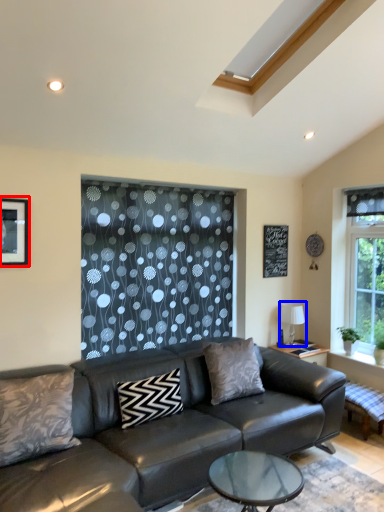
Question: Which object is further to the camera taking this photo, picture frame (highlighted by a red box) or lamp (highlighted by a blue box)?

Choices:
 (A) picture frame
 (B) lamp

Answer: (B)